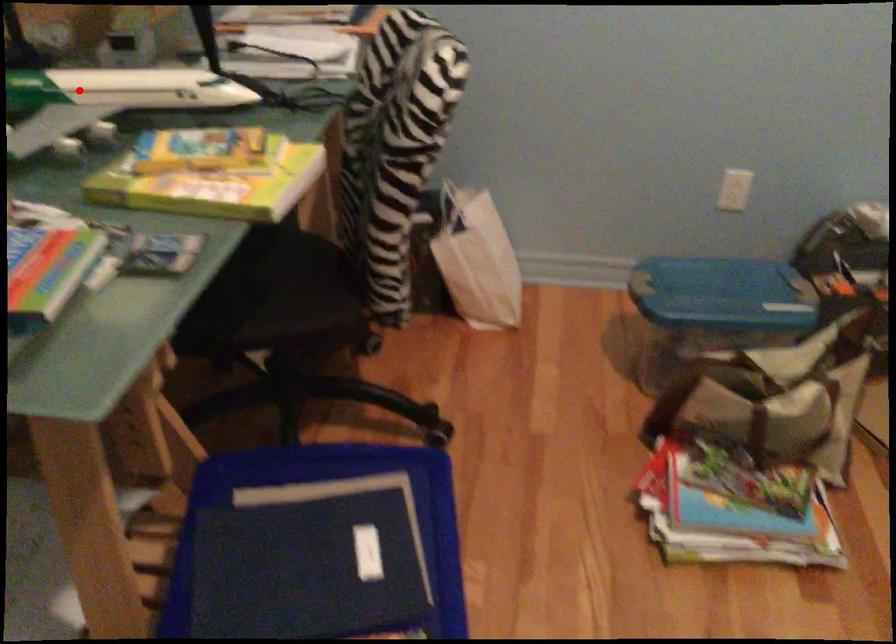
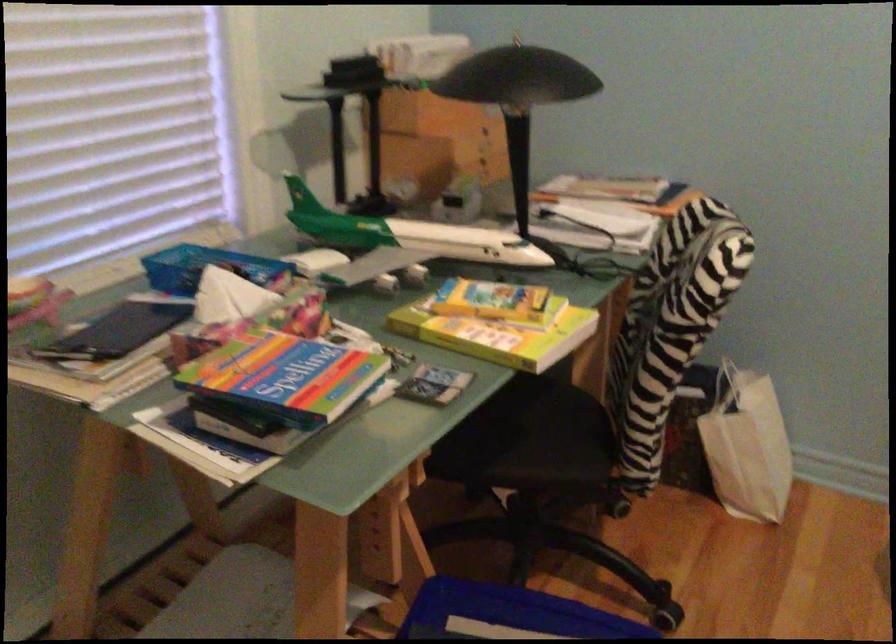
Locate, in the second image, the point that corresponds to the highlighted location in the first image.

(408, 232)